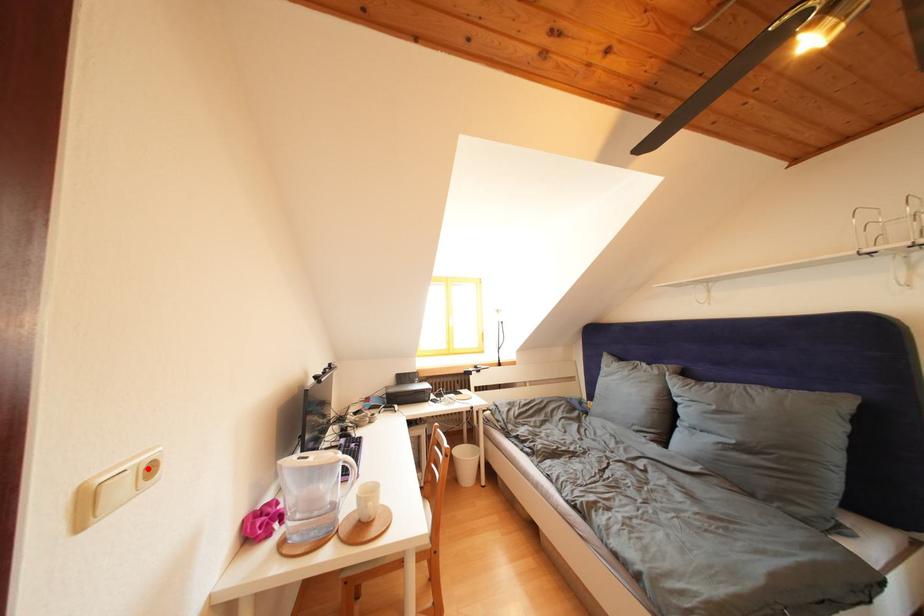
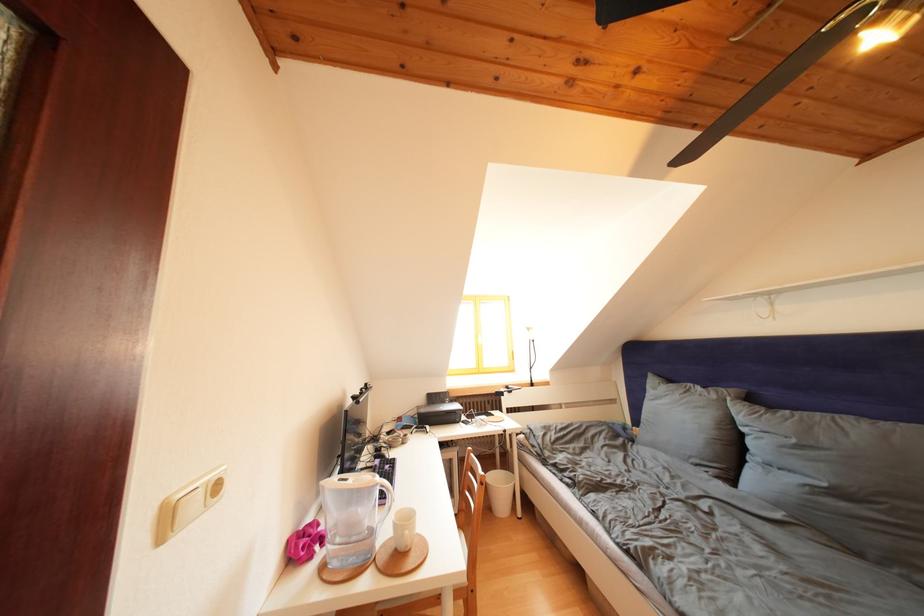
The point at the highlighted location is marked in the first image. Where is the corresponding point in the second image?

(216, 487)